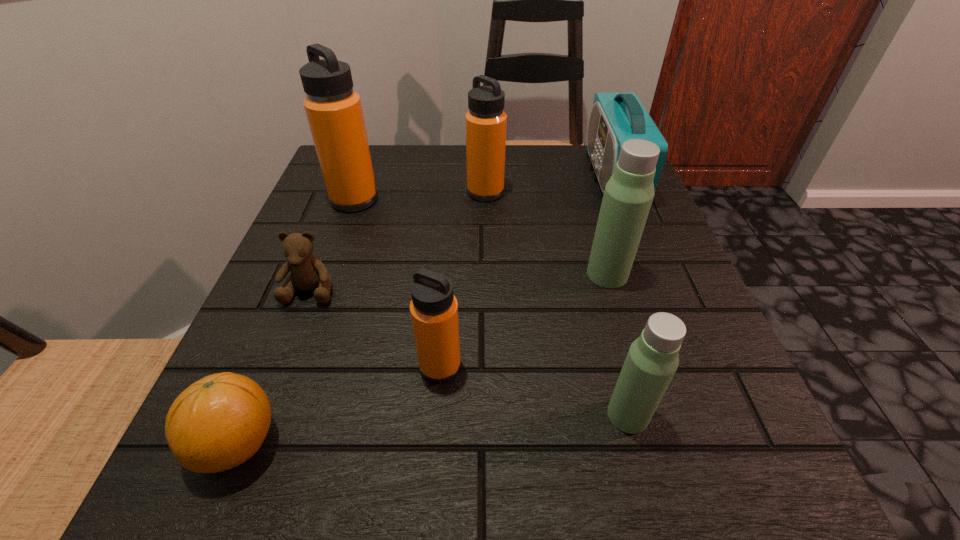
Where is `vacant space situated 0.210m on the back of the smallest orange thermos bottle`? The height and width of the screenshot is (540, 960). vacant space situated 0.210m on the back of the smallest orange thermos bottle is located at coordinates pyautogui.click(x=448, y=255).

Locate an element on the screen. The width and height of the screenshot is (960, 540). free space located 0.250m on the front-facing side of the teddy bear is located at coordinates (244, 463).

Locate an element on the screen. free space located on the right of the orange orange is located at coordinates (499, 443).

The image size is (960, 540). I want to click on radio receiver that is at the far edge, so click(615, 118).

Locate an element on the screen. The image size is (960, 540). object present at the near edge is located at coordinates pyautogui.click(x=219, y=422).

You are a GUI agent. You are given a task and a screenshot of the screen. Output one action in this format:
    pyautogui.click(x=<x>, y=<y>)
    Task: Click on the thermos bottle present at the left edge
    This screenshot has width=960, height=540.
    Given the screenshot: What is the action you would take?
    pyautogui.click(x=333, y=109)

Find the location of a particular element. teddy bear that is at the left edge is located at coordinates (308, 273).

The height and width of the screenshot is (540, 960). Identify the location of orange that is at the left edge. (219, 422).

Find the location of a particular element. This screenshot has height=540, width=960. radio receiver situated at the right edge is located at coordinates (615, 118).

Where is `object positioned at the far left corner`? This screenshot has height=540, width=960. object positioned at the far left corner is located at coordinates (333, 109).